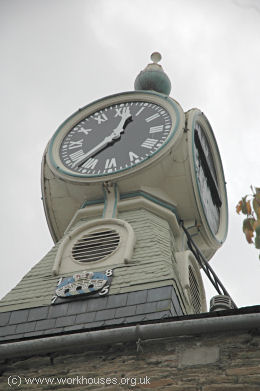
Where is `ladder`? ladder is located at coordinates (215, 283).